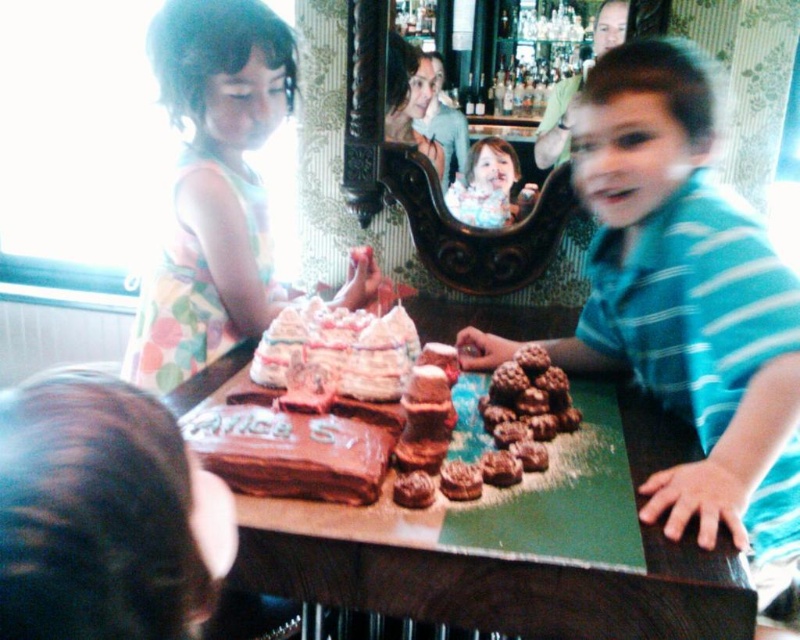
Question: Considering the relative positions of brown cardboard table at center and chocolate textured cookie at center in the image provided, where is brown cardboard table at center located with respect to chocolate textured cookie at center?

Choices:
 (A) above
 (B) below

Answer: (B)

Question: Based on their relative distances, which object is farther from the matte brown cookies at right?

Choices:
 (A) brown cardboard table at center
 (B) chocolate textured cookie at center

Answer: (B)

Question: Which point is farther from the camera taking this photo?

Choices:
 (A) (634, 172)
 (B) (472, 492)

Answer: (A)

Question: Which of these objects is positioned closest to the matte brown cookies at right?

Choices:
 (A) brown cardboard table at center
 (B) chocolate textured cookie at center
 (C) smooth cream dress at upper left
 (D) pastel floral dress at left

Answer: (A)

Question: Is matte brown cookies at right smaller than smooth cream dress at upper left?

Choices:
 (A) no
 (B) yes

Answer: (A)

Question: Where is matte brown cookies at right located in relation to brown cardboard table at center in the image?

Choices:
 (A) right
 (B) left

Answer: (A)